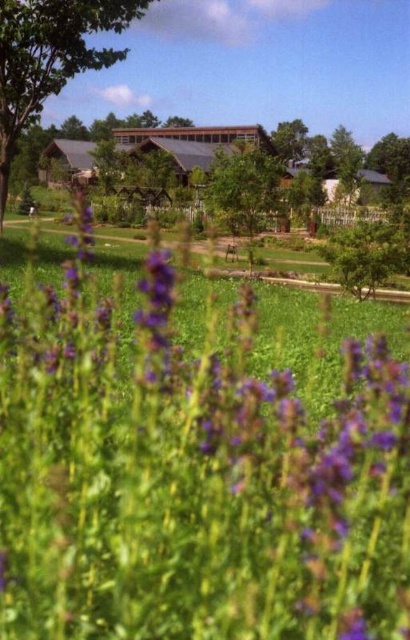
Question: Can you confirm if purple matte flower at center is positioned below green leafy tree at upper left?

Choices:
 (A) yes
 (B) no

Answer: (A)

Question: Does purple matte flower at center appear on the right side of green leafy tree at upper left?

Choices:
 (A) no
 (B) yes

Answer: (B)

Question: Does purple matte flower at center have a lesser width compared to green leafy tree at upper left?

Choices:
 (A) yes
 (B) no

Answer: (A)

Question: Among these points, which one is nearest to the camera?

Choices:
 (A) (36, 484)
 (B) (25, 4)

Answer: (A)